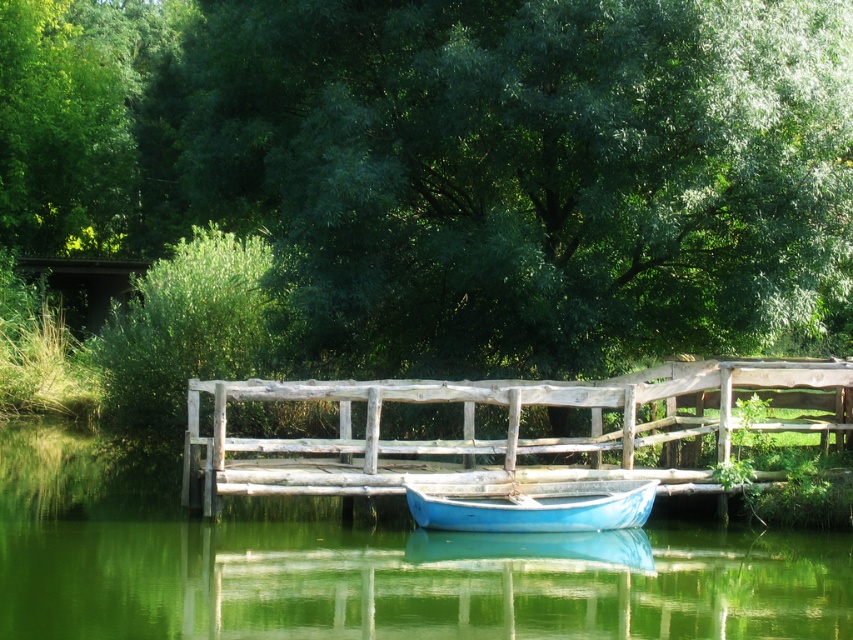
Question: Among these points, which one is nearest to the camera?

Choices:
 (A) tap(508, 528)
 (B) tap(450, 486)
 (C) tap(671, 198)

Answer: (A)

Question: Is weathered wood bridge at center below green leafy tree at upper left?

Choices:
 (A) no
 (B) yes

Answer: (B)

Question: Is weathered wood bridge at center wider than green leafy tree at upper left?

Choices:
 (A) no
 (B) yes

Answer: (B)

Question: From the image, what is the correct spatial relationship of green leafy tree at upper left in relation to matte blue boat at center?

Choices:
 (A) above
 (B) below

Answer: (A)

Question: Which point appears closest to the camera in this image?

Choices:
 (A) (265, 484)
 (B) (12, 36)
 (C) (676, 16)
 (D) (577, 509)

Answer: (A)

Question: Among these objects, which one is farthest from the camera?

Choices:
 (A) weathered wood bridge at center
 (B) green leafy tree at upper center
 (C) green leafy tree at upper left
 (D) matte blue boat at center

Answer: (C)